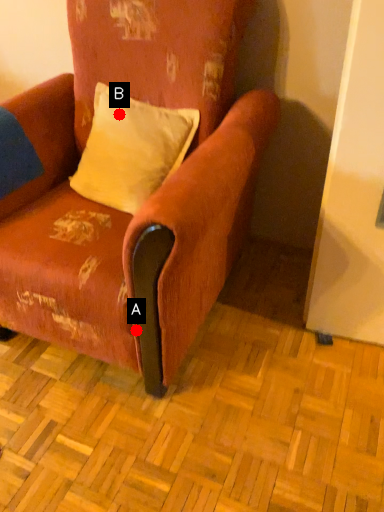
Question: Two points are circled on the image, labeled by A and B beside each circle. Which of the following is the farthest from the observer?

Choices:
 (A) A is further
 (B) B is further

Answer: (B)